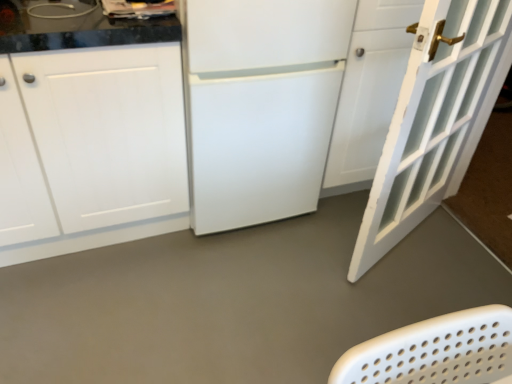
The width and height of the screenshot is (512, 384). I want to click on vacant area that is in front of white painted wood door at right, so click(385, 307).